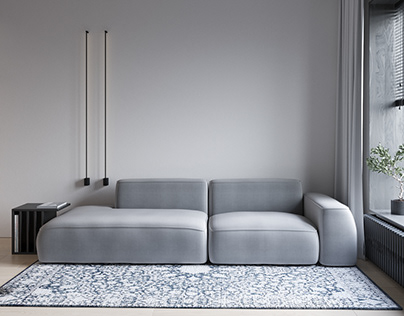
Locate an element on the screen. Image resolution: width=404 pixels, height=316 pixels. curtain is located at coordinates (351, 80).